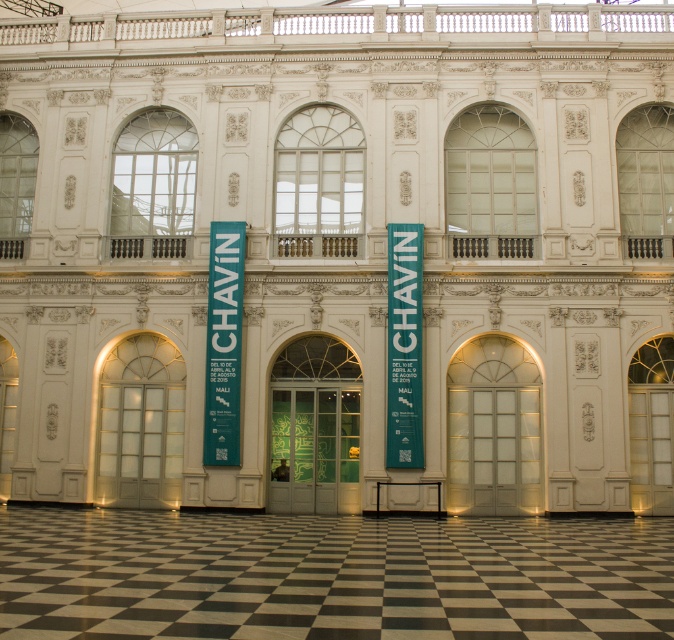
Does black checkered floor at center appear over green fabric banner at center?

Actually, black checkered floor at center is below green fabric banner at center.

Is point (59, 636) in front of point (406, 358)?

Yes, point (59, 636) is in front of point (406, 358).

You are a GUI agent. You are given a task and a screenshot of the screen. Output one action in this format:
    pyautogui.click(x=<x>, y=<y>)
    Task: Click on the black checkered floor at center
    This screenshot has width=674, height=640.
    Given the screenshot: What is the action you would take?
    pyautogui.click(x=330, y=576)

Between point (216, 355) and point (408, 432), which one is positioned behind?

The point (216, 355) is more distant.

Which of these two, teal fabric banner at center or green fabric banner at center, stands taller?

With more height is teal fabric banner at center.

What do you see at coordinates (222, 342) in the screenshot?
I see `teal fabric banner at center` at bounding box center [222, 342].

At what (x,y) coordinates should I click in order to perform the action: click on teal fabric banner at center. Please return your answer as a coordinate pair (x, y). Image resolution: width=674 pixels, height=640 pixels. Looking at the image, I should click on (222, 342).

Can you confirm if black checkered floor at center is bigger than teal fabric banner at center?

Yes.

Which is in front, point (443, 620) or point (212, 273)?

Point (443, 620) is in front.

Identify the location of black checkered floor at center. (330, 576).

At what (x,y) coordinates should I click in order to perform the action: click on black checkered floor at center. Please return your answer as a coordinate pair (x, y). Image resolution: width=674 pixels, height=640 pixels. Looking at the image, I should click on (330, 576).